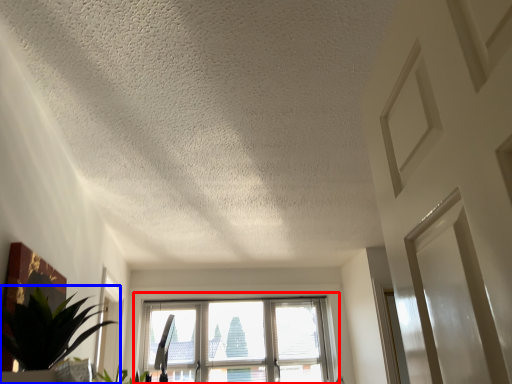
Question: Which point is further to the camera, window (highlighted by a red box) or houseplant (highlighted by a blue box)?

Choices:
 (A) window
 (B) houseplant

Answer: (A)